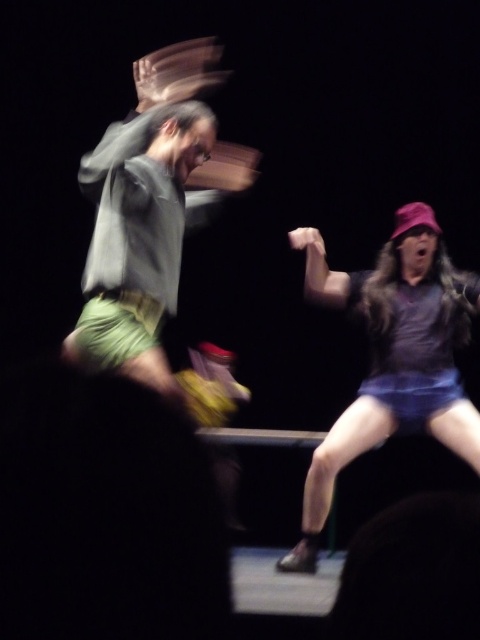
Who is shorter, green cotton shorts at left or purple matte shirt at center?

green cotton shorts at left

Who is more forward, (162, 385) or (419, 332)?

Positioned in front is point (162, 385).

The width and height of the screenshot is (480, 640). Find the location of `green cotton shorts at left`. green cotton shorts at left is located at coordinates (149, 211).